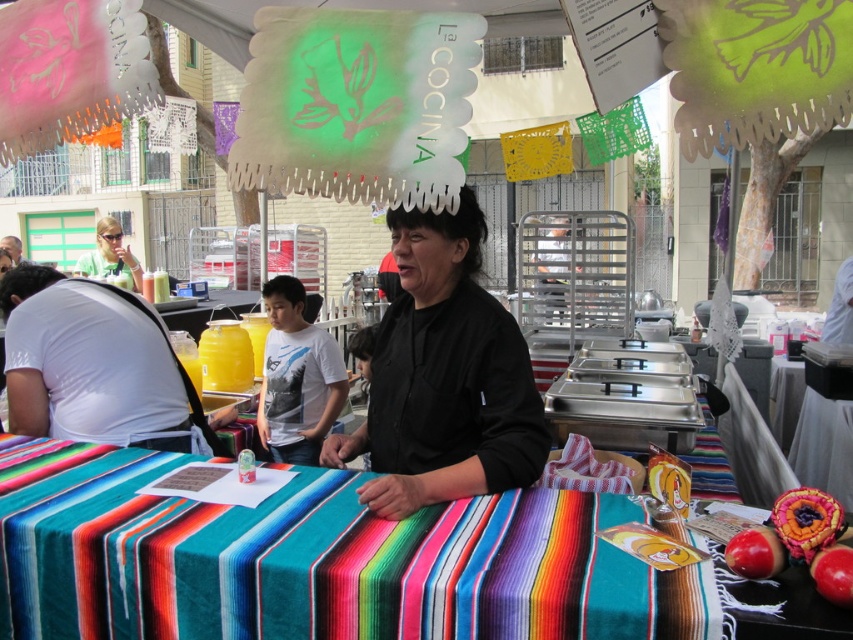
Question: Does multicolored woven cloth at center appear on the left side of black matte shirt at center?

Choices:
 (A) yes
 (B) no

Answer: (A)

Question: Among these objects, which one is farthest from the camera?

Choices:
 (A) white matte shirt at left
 (B) white fabric shirt at left
 (C) matte green shirt at upper left

Answer: (B)

Question: Does multicolored woven cloth at center have a smaller size compared to white fabric shirt at left?

Choices:
 (A) no
 (B) yes

Answer: (A)

Question: Which point is farther from the camera taking this photo?

Choices:
 (A) (96, 257)
 (B) (271, 288)
 (C) (592, 572)
 (D) (416, 412)

Answer: (A)

Question: Which point is farther to the camera?

Choices:
 (A) (343, 403)
 (B) (764, 525)
 (C) (10, 241)

Answer: (C)

Question: Is the position of white matte shirt at left less distant than that of white cotton t-shirt at center?

Choices:
 (A) yes
 (B) no

Answer: (A)